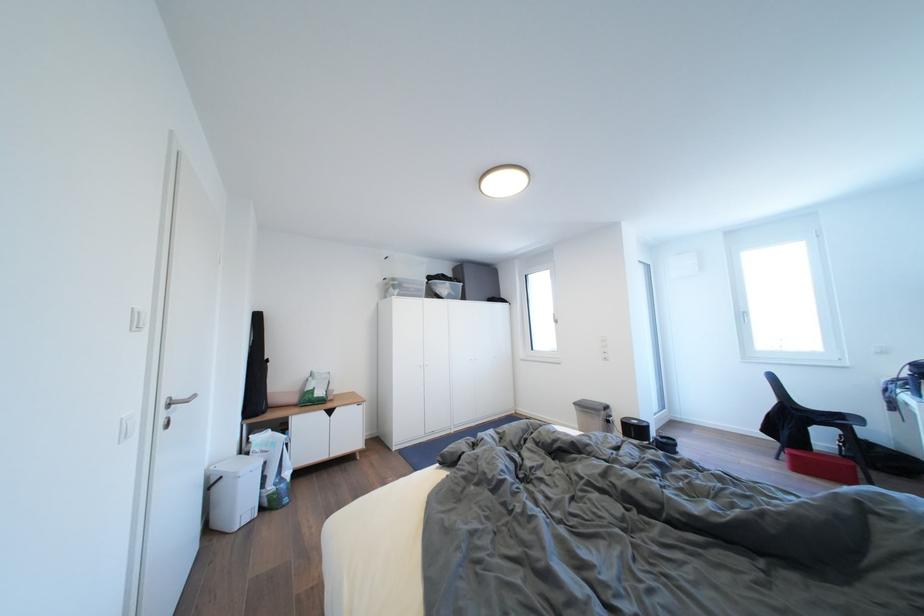
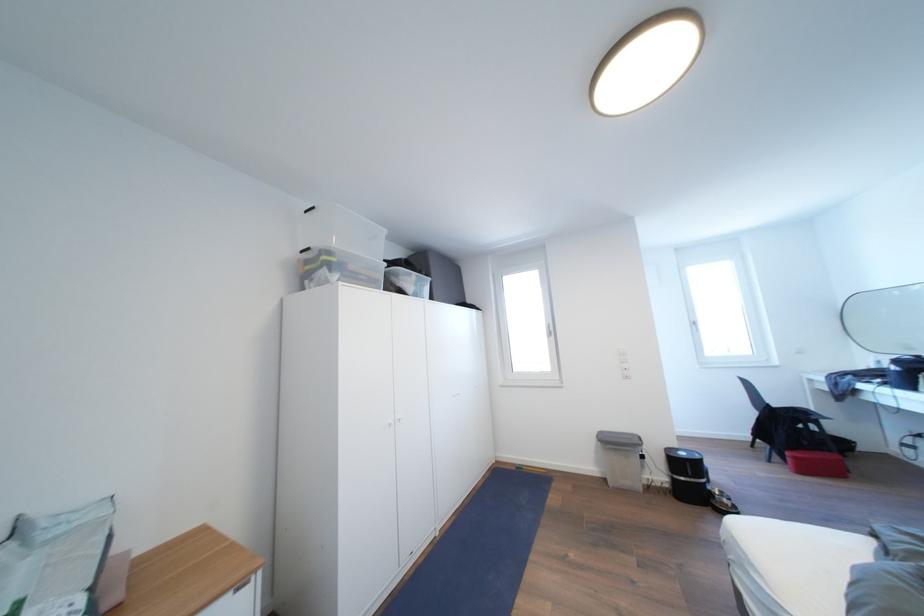
Where in the second image is the point corresponding to the point at 609,408 from the first image?

(639, 440)